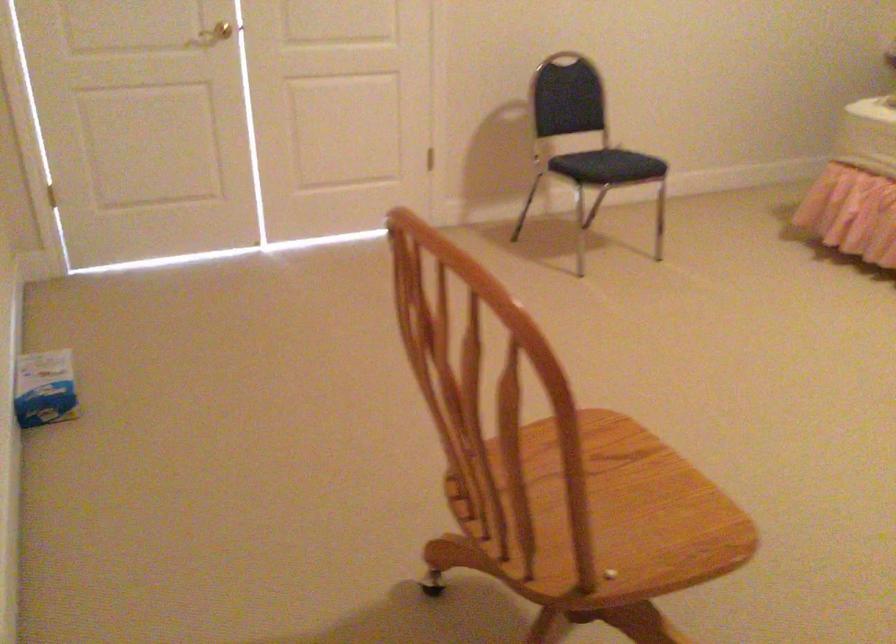
Where is `brass door handle`? Image resolution: width=896 pixels, height=644 pixels. brass door handle is located at coordinates (214, 33).